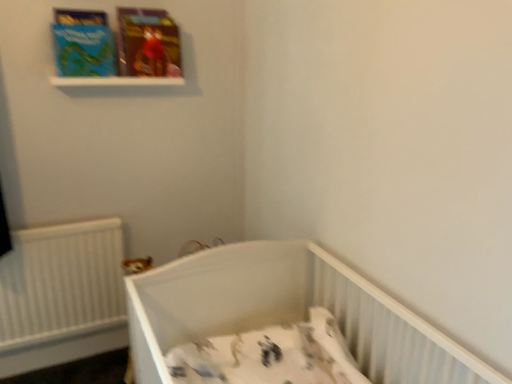
Question: Is white plastic balustrade at upper center smaller than white plastic crib at lower center?

Choices:
 (A) yes
 (B) no

Answer: (A)

Question: Is white plastic balustrade at upper center positioned with its back to white plastic crib at lower center?

Choices:
 (A) yes
 (B) no

Answer: (B)

Question: From a real-world perspective, is white plastic balustrade at upper center beneath white plastic crib at lower center?

Choices:
 (A) yes
 (B) no

Answer: (B)

Question: Is white plastic balustrade at upper center far from white plastic crib at lower center?

Choices:
 (A) yes
 (B) no

Answer: (A)

Question: Can you confirm if white plastic balustrade at upper center is bigger than white plastic crib at lower center?

Choices:
 (A) yes
 (B) no

Answer: (B)

Question: Does white plastic balustrade at upper center have a greater height compared to white plastic crib at lower center?

Choices:
 (A) no
 (B) yes

Answer: (A)

Question: Can you confirm if white plastic balustrade at upper center is thinner than matte blue paperback book at upper left, which is counted as the 2th paperback book, starting from the right?

Choices:
 (A) no
 (B) yes

Answer: (A)

Question: Is matte blue paperback book at upper left, which is counted as the 1th paperback book, starting from the left, at the back of white plastic balustrade at upper center?

Choices:
 (A) no
 (B) yes

Answer: (A)

Question: Does white plastic balustrade at upper center have a smaller size compared to matte blue paperback book at upper left, which is counted as the 1th paperback book, starting from the left?

Choices:
 (A) no
 (B) yes

Answer: (B)

Question: Does white plastic balustrade at upper center have a lesser height compared to matte blue paperback book at upper left, which is counted as the 2th paperback book, starting from the right?

Choices:
 (A) yes
 (B) no

Answer: (A)

Question: From a real-world perspective, is white plastic balustrade at upper center on matte blue paperback book at upper left, which is counted as the 1th paperback book, starting from the left?

Choices:
 (A) no
 (B) yes

Answer: (A)

Question: Is white plastic balustrade at upper center closer to camera compared to matte blue paperback book at upper left, which is counted as the 2th paperback book, starting from the right?

Choices:
 (A) yes
 (B) no

Answer: (B)

Question: Are matte cardboard book at upper left, the 2th paperback book when ordered from left to right, and matte blue paperback book at upper left, which is counted as the 1th paperback book, starting from the left, located far from each other?

Choices:
 (A) no
 (B) yes

Answer: (A)